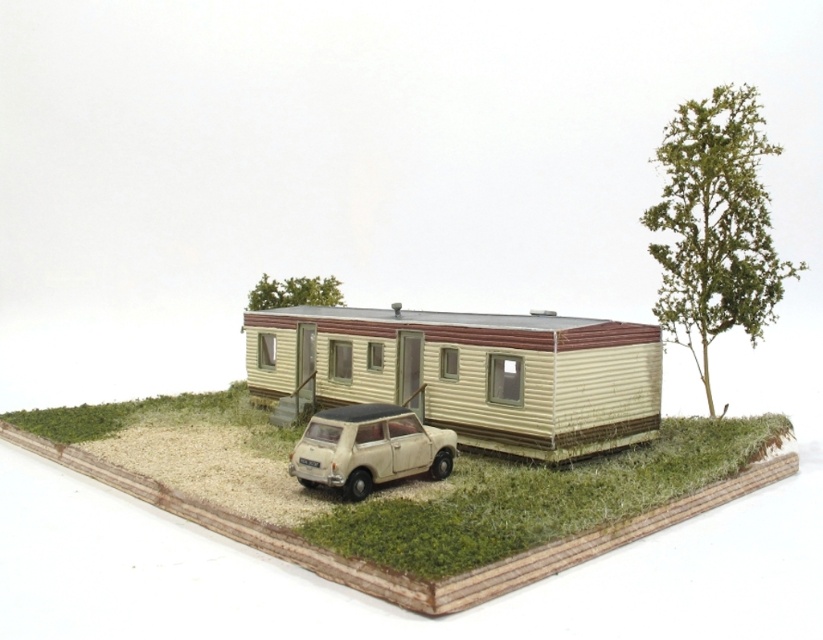
Question: Which object is farther from the camera taking this photo?

Choices:
 (A) white matte car at center
 (B) green textured tree at upper right
 (C) green grass at lower center
 (D) green leafy tree at upper center

Answer: (D)

Question: Can you confirm if green grass at lower center is positioned to the left of green leafy tree at upper center?

Choices:
 (A) no
 (B) yes

Answer: (A)

Question: Is green grass at lower center thinner than green leafy tree at upper center?

Choices:
 (A) yes
 (B) no

Answer: (B)

Question: Which is farther from the white matte car at center?

Choices:
 (A) green grass at lower center
 (B) green leafy tree at upper center
 (C) green textured tree at upper right

Answer: (B)

Question: Which object appears closest to the camera in this image?

Choices:
 (A) white matte car at center
 (B) green leafy tree at upper center
 (C) green textured tree at upper right
 (D) green grass at lower center

Answer: (D)

Question: Can you confirm if green grass at lower center is wider than green textured tree at upper right?

Choices:
 (A) yes
 (B) no

Answer: (A)